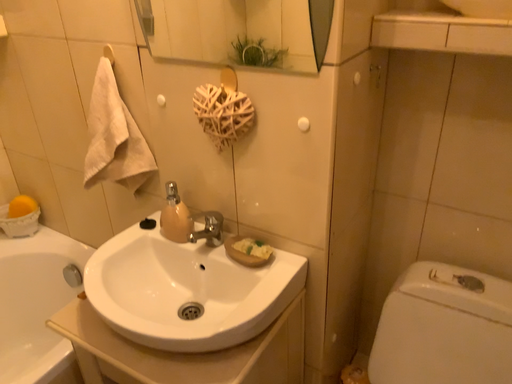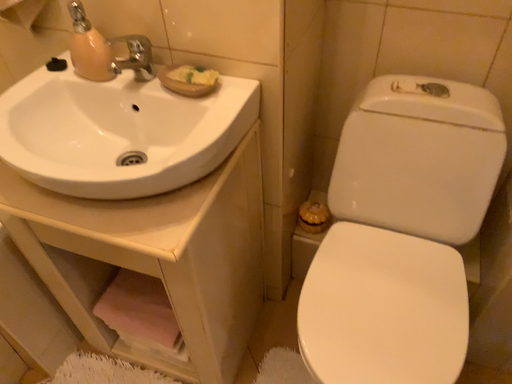
Question: Which way did the camera rotate in the video?

Choices:
 (A) rotated upward
 (B) rotated downward

Answer: (B)